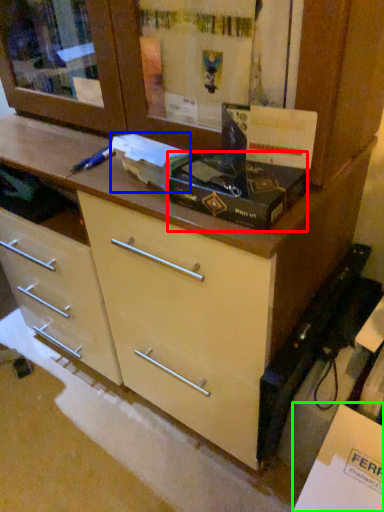
Question: Which object is positioned closest to box (highlighted by a red box)? Select from box (highlighted by a blue box) and cabinetry (highlighted by a green box).

Choices:
 (A) box
 (B) cabinetry

Answer: (A)